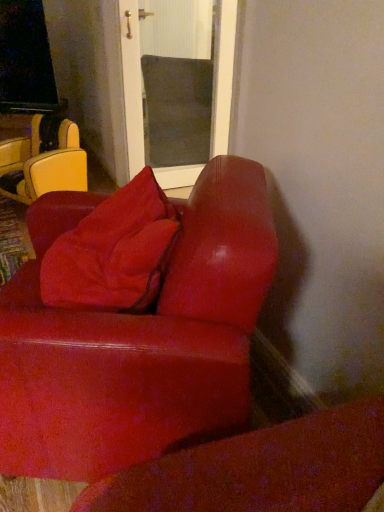
Question: Is suede-like red pillow at center oriented towards leather-like yellow chair at left?

Choices:
 (A) yes
 (B) no

Answer: (B)

Question: Does suede-like red pillow at center have a greater width compared to leather-like yellow chair at left?

Choices:
 (A) yes
 (B) no

Answer: (B)

Question: From the image's perspective, is suede-like red pillow at center below leather-like yellow chair at left?

Choices:
 (A) no
 (B) yes

Answer: (B)

Question: Is suede-like red pillow at center bigger than leather-like yellow chair at left?

Choices:
 (A) no
 (B) yes

Answer: (A)

Question: From the image's perspective, is suede-like red pillow at center located above leather-like yellow chair at left?

Choices:
 (A) yes
 (B) no

Answer: (B)

Question: From the image's perspective, is suede-like red pillow at center above or below leather-like yellow chair at left?

Choices:
 (A) above
 (B) below

Answer: (B)

Question: Is suede-like red pillow at center wider or thinner than leather-like yellow chair at left?

Choices:
 (A) wide
 (B) thin

Answer: (B)

Question: Do you think suede-like red pillow at center is within leather-like yellow chair at left, or outside of it?

Choices:
 (A) inside
 (B) outside

Answer: (B)

Question: Looking at the image, does suede-like red pillow at center seem bigger or smaller compared to leather-like yellow chair at left?

Choices:
 (A) big
 (B) small

Answer: (B)

Question: Considering their positions, is suede-like red couch at lower right located in front of or behind suede-like red pillow at center?

Choices:
 (A) front
 (B) behind

Answer: (A)

Question: From the image's perspective, is suede-like red couch at lower right above or below suede-like red pillow at center?

Choices:
 (A) above
 (B) below

Answer: (B)

Question: Looking at their shapes, would you say suede-like red couch at lower right is wider or thinner than suede-like red pillow at center?

Choices:
 (A) wide
 (B) thin

Answer: (A)

Question: Is suede-like red couch at lower right situated inside suede-like red pillow at center or outside?

Choices:
 (A) inside
 (B) outside

Answer: (B)

Question: Considering the relative positions of leather-like yellow chair at left and suede-like red pillow at center in the image provided, is leather-like yellow chair at left to the left or to the right of suede-like red pillow at center?

Choices:
 (A) left
 (B) right

Answer: (A)

Question: From a real-world perspective, is leather-like yellow chair at left positioned above or below suede-like red pillow at center?

Choices:
 (A) above
 (B) below

Answer: (B)